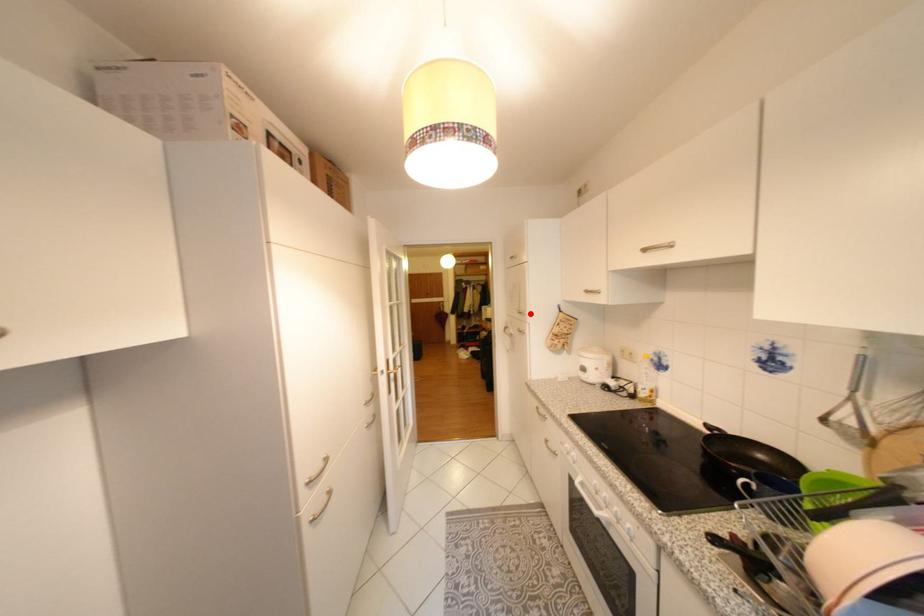
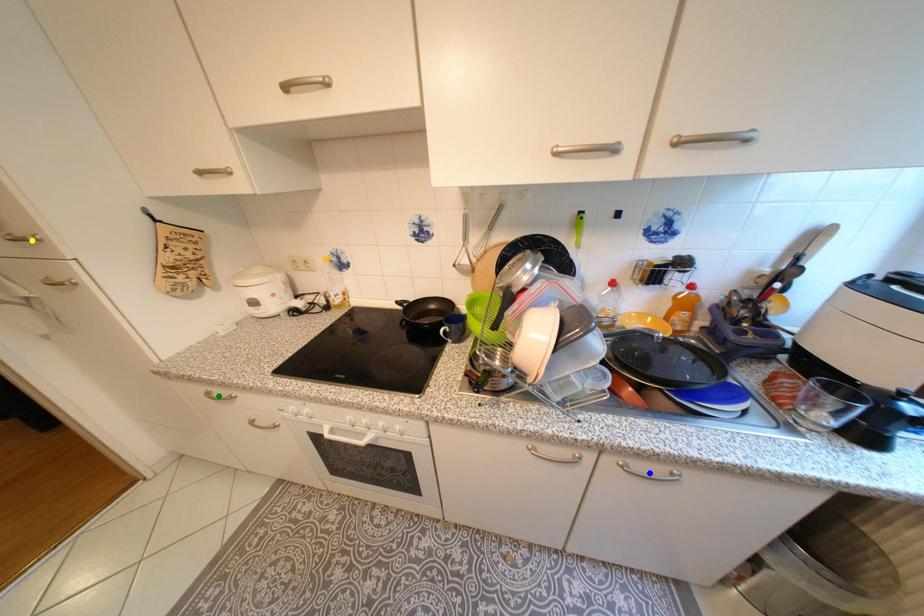
Question: I am providing you with two images of the same scene from different viewpoints. A red point is marked on the first image. You are given multiple points on the second image. In image 2, which mark is for the same physical point as the one in image 1?

Choices:
 (A) green point
 (B) yellow point
 (C) blue point

Answer: (B)